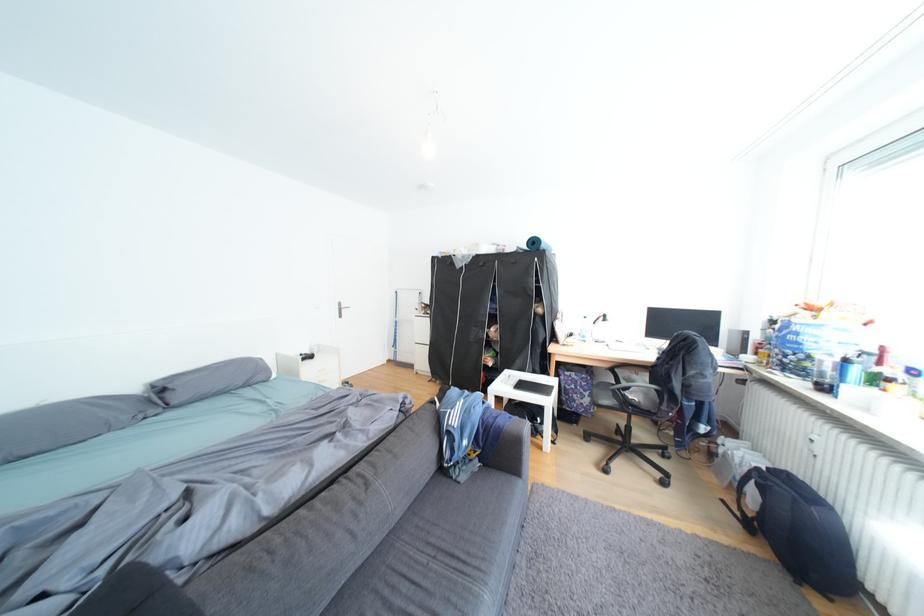
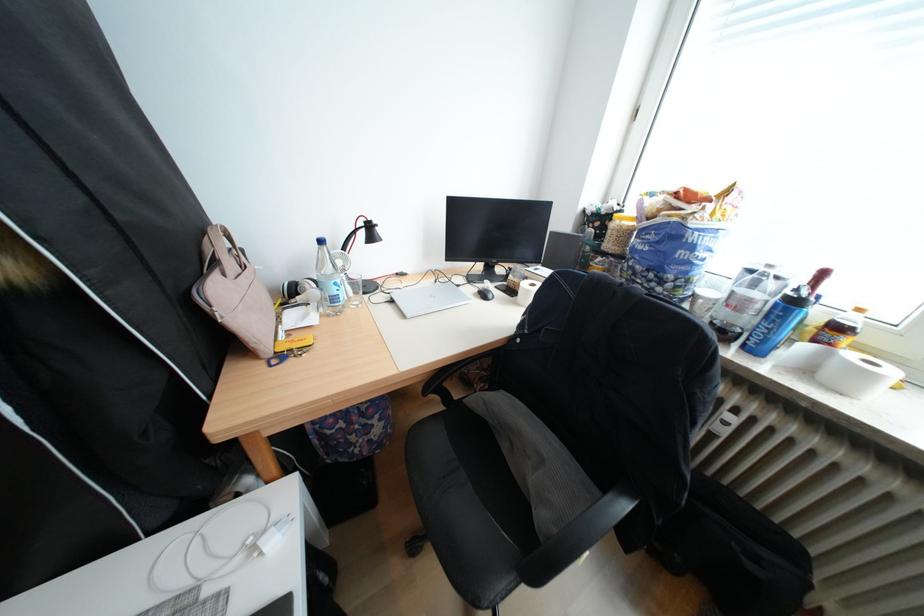
Where in the second image is the point corresponding to [614,320] from the first image?

(374, 235)